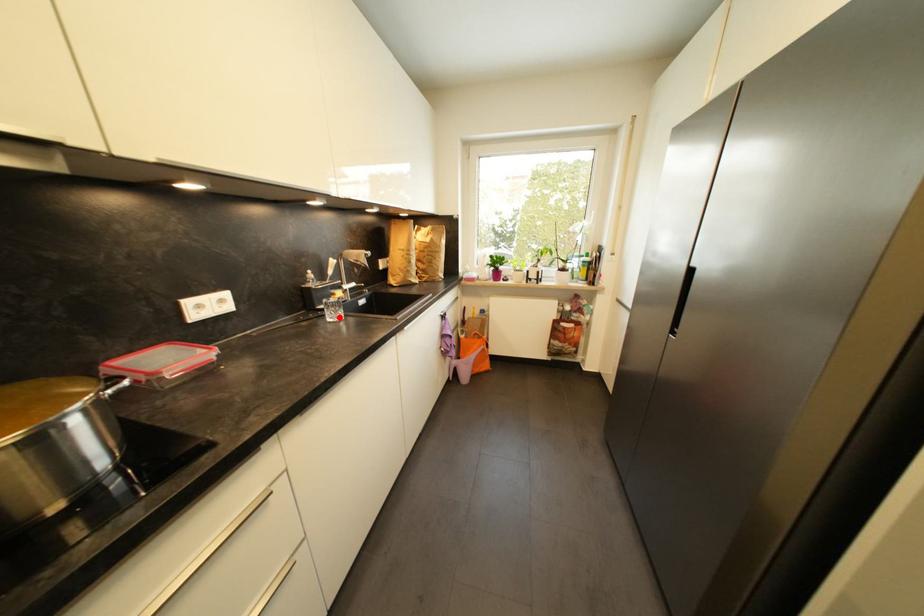
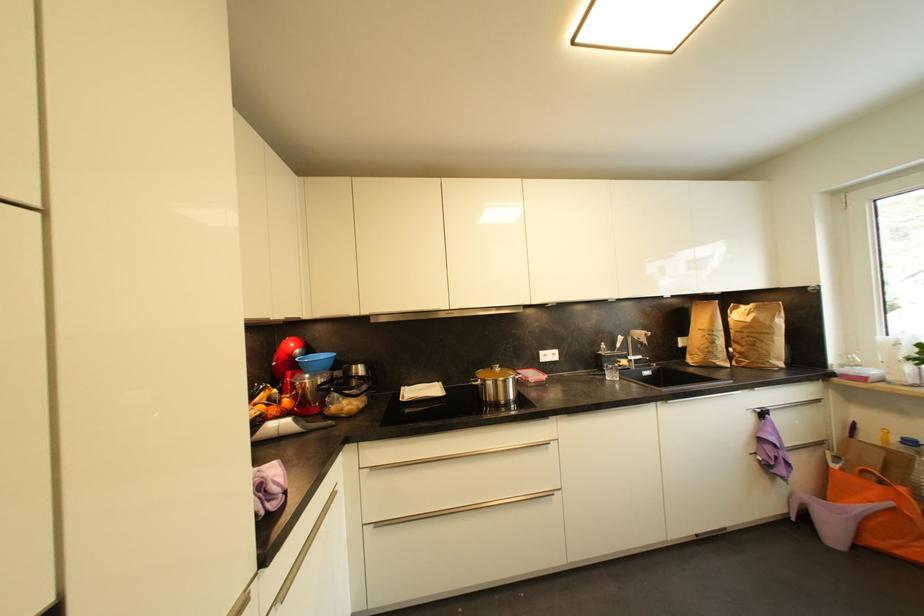
Question: I am providing you with two images of the same scene from different viewpoints. Given a red point in image1, look at the same physical point in image2. Is it:

Choices:
 (A) Closer to the viewpoint
 (B) Farther from the viewpoint

Answer: (B)